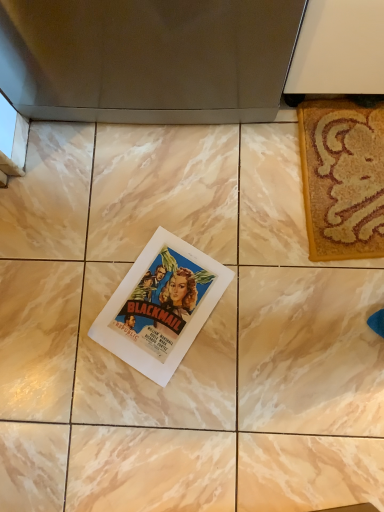
Describe the element at coordinates (161, 306) in the screenshot. I see `white paper at center` at that location.

What is the approximate height of white paper at center?

white paper at center is 1.37 centimeters tall.

At what (x,y) coordinates should I click in order to perform the action: click on white paper at center. Please return your answer as a coordinate pair (x, y). Looking at the image, I should click on (161, 306).

Locate an element on the screen. The image size is (384, 512). white paper at center is located at coordinates (161, 306).